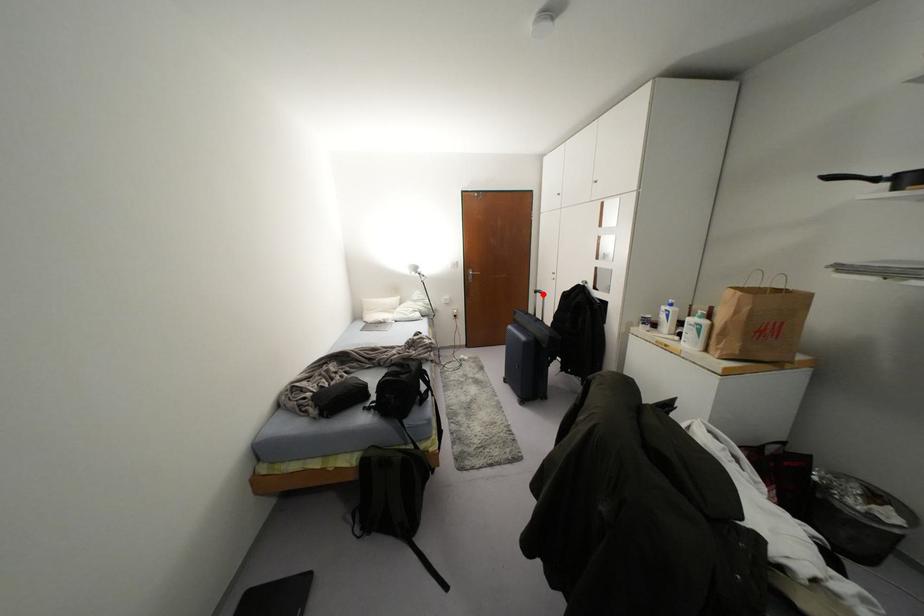
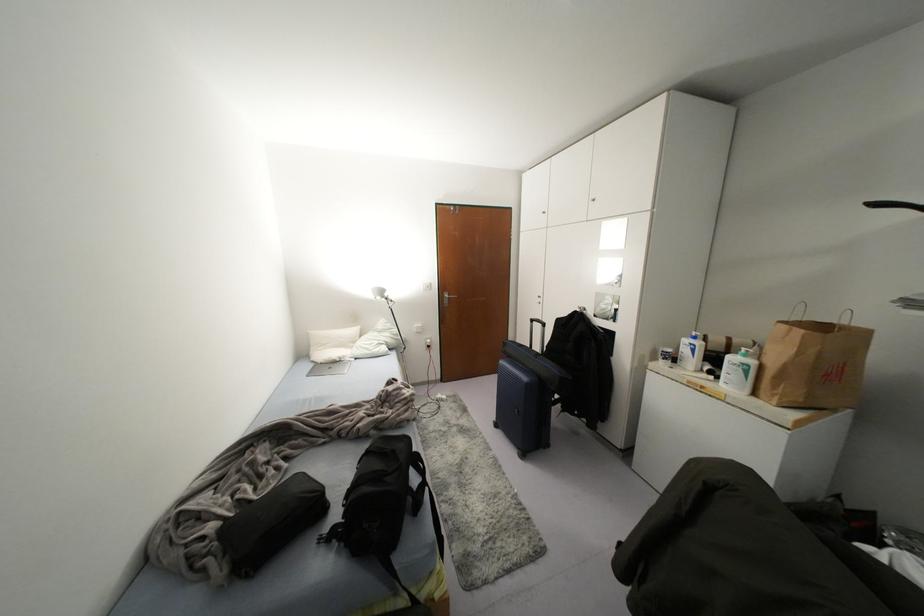
Find the pixel in the second image that matches the highlighted location in the first image.

(542, 323)